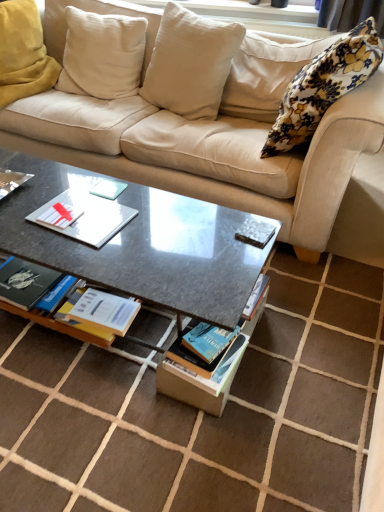
Find the location of a particular element. Image resolution: width=384 pixels, height=512 pixels. free spot in front of metallic silver magazine at center, the 2th magazine ordered from the bottom is located at coordinates (236, 265).